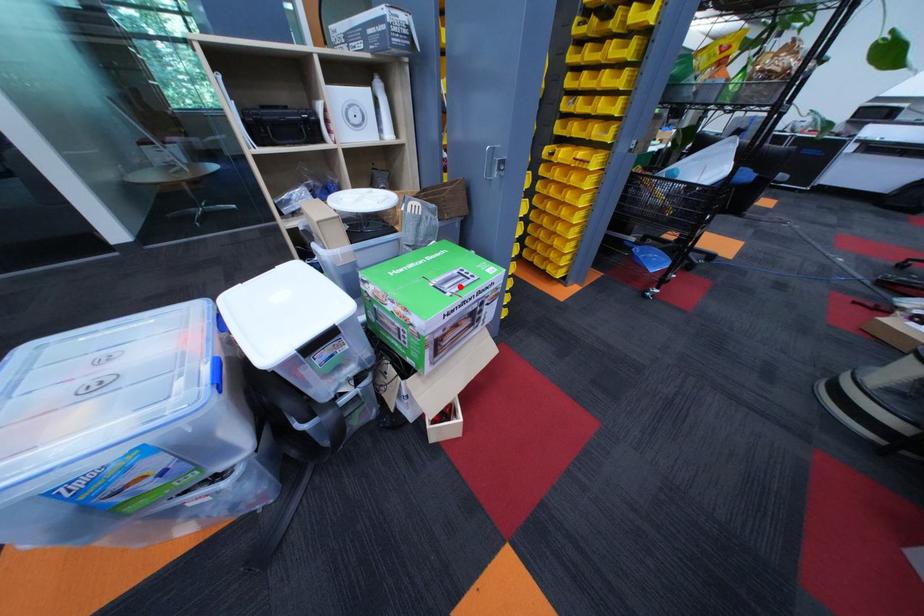
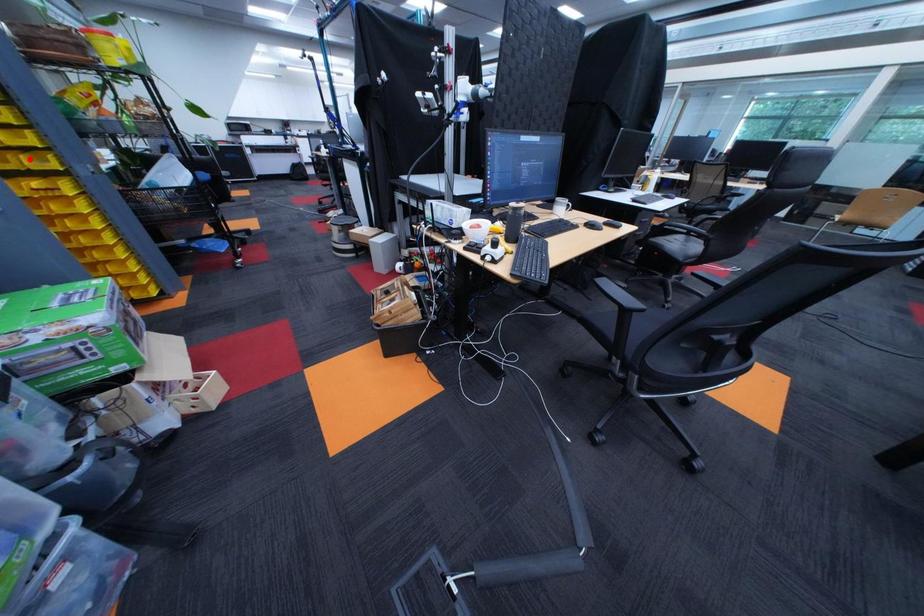
I am providing you with two images of the same scene from different viewpoints. A red point is marked on the first image and another point is marked on the second image. Does the point marked in image1 correspond to the same location as the one in image2?

No